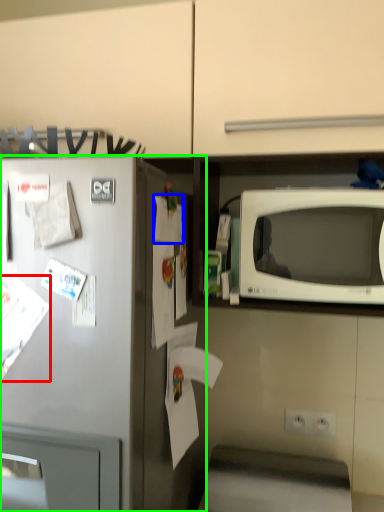
Question: Which object is positioned farthest from paper (highlighted by a red box)? Select from paper (highlighted by a blue box) and refrigerator (highlighted by a green box).

Choices:
 (A) paper
 (B) refrigerator

Answer: (A)